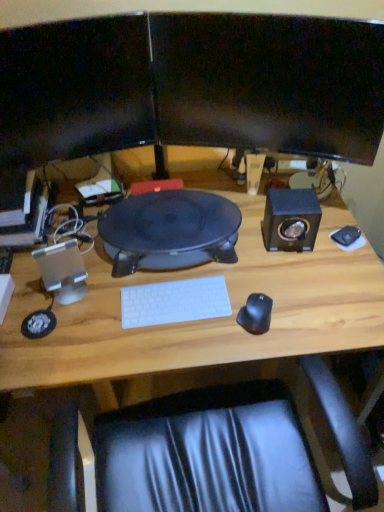
You are a GUI agent. You are given a task and a screenshot of the screen. Output one action in this format:
    pyautogui.click(x=<x>, y=<y>)
    Task: Click on the vacant area that lies in front of black rubberized mouse at right, the second mouse when ordered from top to bottom
    The height and width of the screenshot is (512, 384).
    Given the screenshot: What is the action you would take?
    pyautogui.click(x=258, y=347)